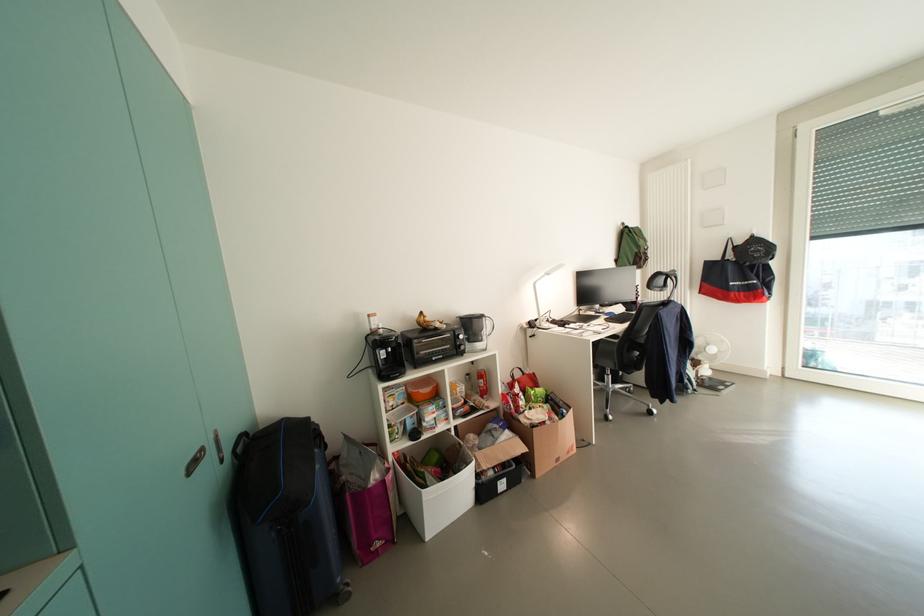
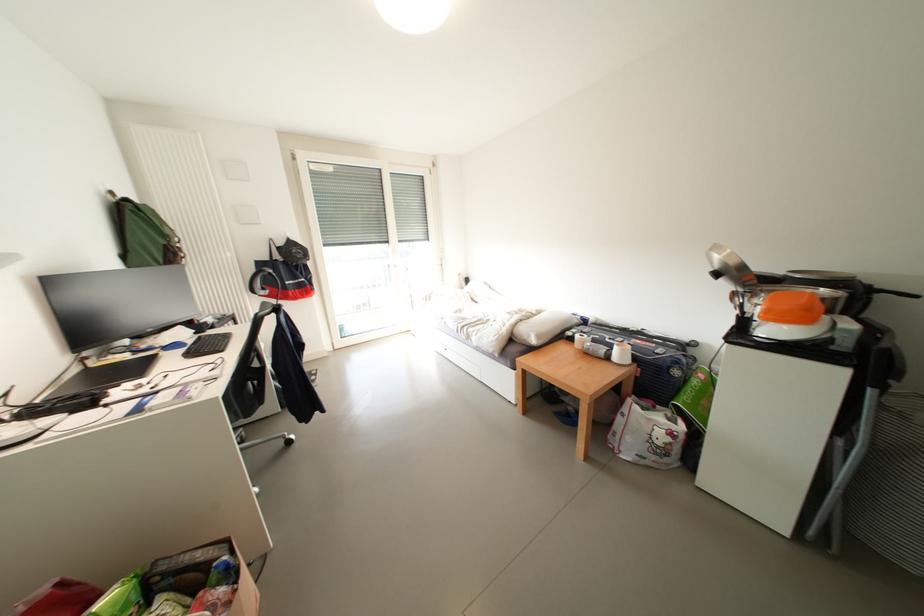
Where in the second image is the point corresponding to (x=761, y=244) from the first image?

(298, 246)